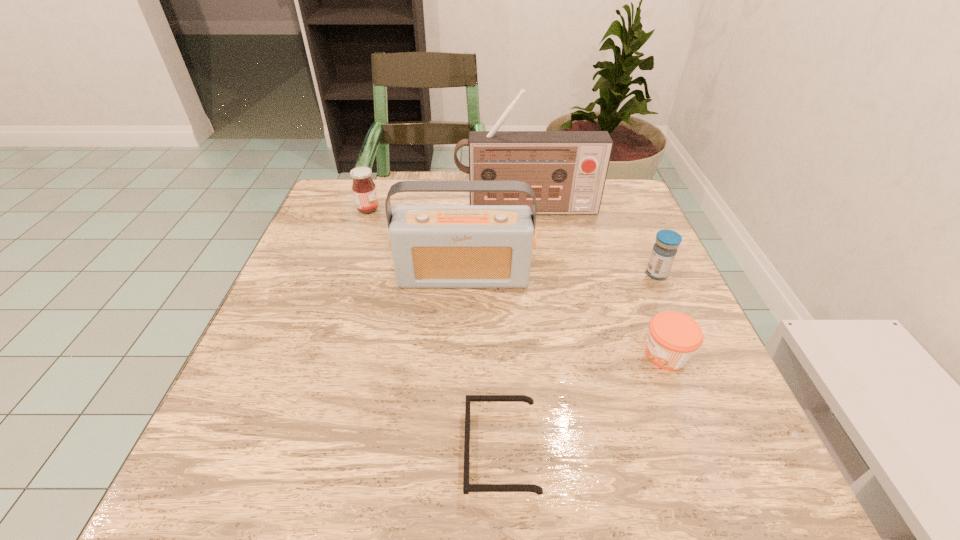
Where is `the shortest object`? This screenshot has height=540, width=960. the shortest object is located at coordinates pos(467,487).

Identify the location of vacant space located on the front panel of the farther radio receiver. The height and width of the screenshot is (540, 960). (543, 330).

Locate an element on the screen. This screenshot has width=960, height=540. free space located on the front-facing side of the nearer radio receiver is located at coordinates (459, 403).

At what (x,y) coordinates should I click in order to perform the action: click on free space located on the label side of the left jam. Please return your answer as a coordinate pair (x, y). This screenshot has height=540, width=960. Looking at the image, I should click on (533, 209).

The height and width of the screenshot is (540, 960). I want to click on free space located 0.160m on the back of the medicine, so tap(635, 225).

The width and height of the screenshot is (960, 540). I want to click on blank space located 0.320m on the front label of the shorter jam, so click(465, 355).

Identify the location of vacant space located 0.300m on the front label of the shorter jam. The height and width of the screenshot is (540, 960). (476, 355).

I want to click on vacant region located on the front label of the shorter jam, so click(476, 355).

At what (x,y) coordinates should I click in order to perform the action: click on free space located on the front-facing side of the nearest object. Please return your answer as a coordinate pair (x, y). Looking at the image, I should click on (419, 450).

Where is `blank space located 0.310m on the front-facing side of the nearest object`? The height and width of the screenshot is (540, 960). blank space located 0.310m on the front-facing side of the nearest object is located at coordinates (260, 450).